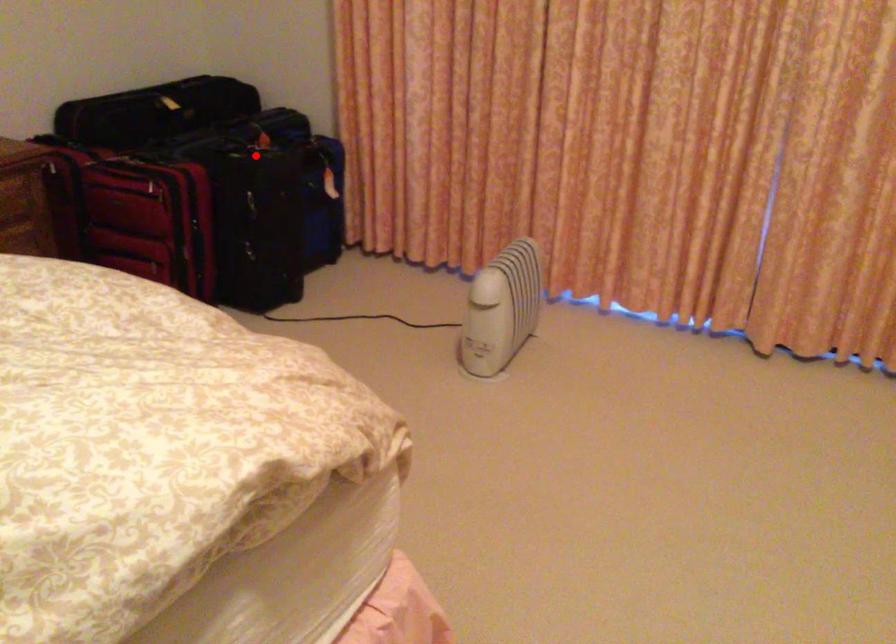
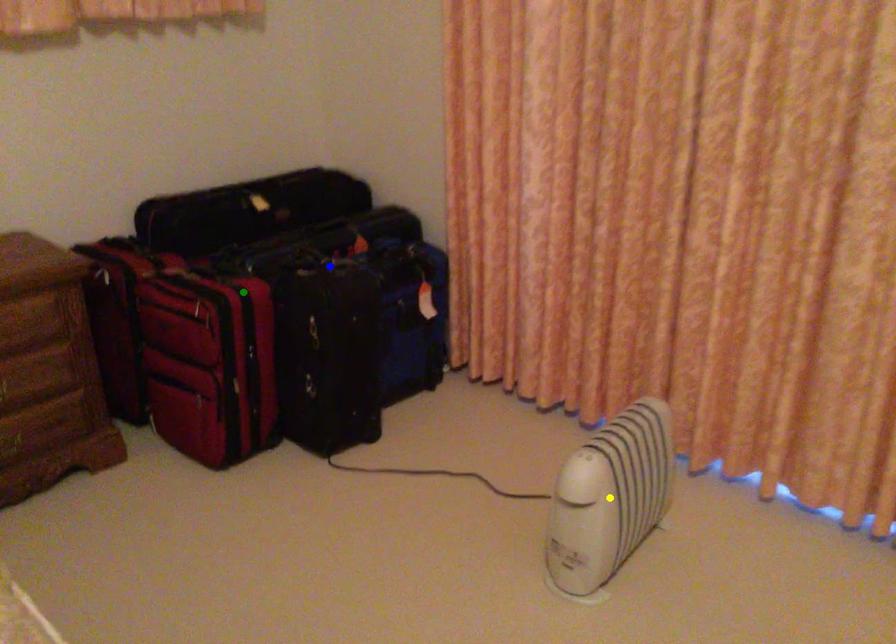
Question: I am providing you with two images of the same scene from different viewpoints. A red point is marked on the first image. You are given multiple points on the second image. Which mark in image 2 goes with the point in image 1?

Choices:
 (A) blue point
 (B) green point
 (C) yellow point

Answer: (A)